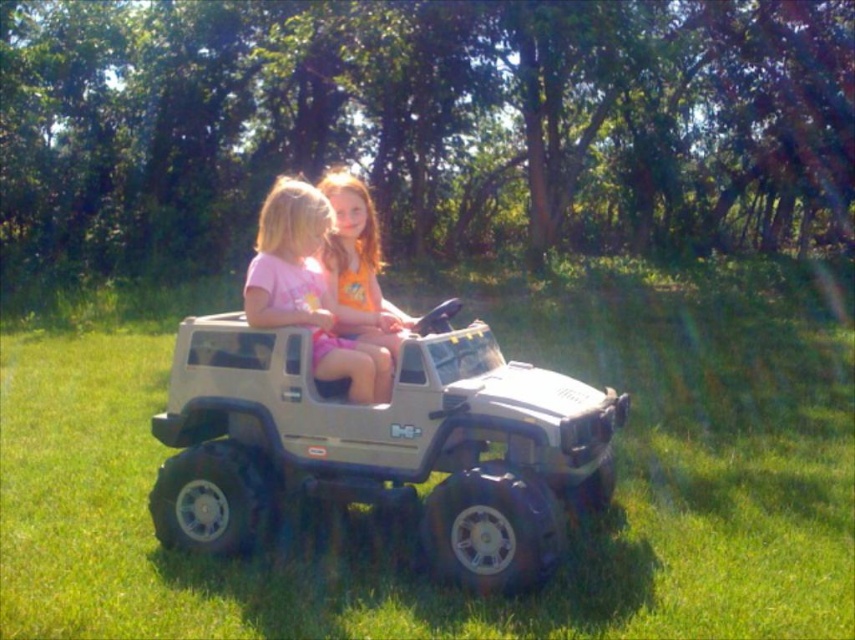
Consider the image. Does green grass at center have a greater width compared to matte pink shirt at center?

A: Correct, the width of green grass at center exceeds that of matte pink shirt at center.

Is green grass at center bigger than matte pink shirt at center?

Yes.

The image size is (855, 640). Describe the element at coordinates (401, 536) in the screenshot. I see `green grass at center` at that location.

In order to click on green grass at center in this screenshot , I will do `click(401, 536)`.

In the scene shown: Does green grass at center appear over orange cotton shirt at center?

Incorrect, green grass at center is not positioned above orange cotton shirt at center.

Who is positioned more to the left, green grass at center or orange cotton shirt at center?

orange cotton shirt at center is more to the left.

What are the coordinates of `green grass at center` in the screenshot? It's located at (401, 536).

Does green grass at center have a lesser width compared to matte silver toy jeep at center?

In fact, green grass at center might be wider than matte silver toy jeep at center.

Who is higher up, green grass at center or matte silver toy jeep at center?

green grass at center is above.

Does point (699, 442) lie in front of point (187, 371)?

No, (699, 442) is further to viewer.

Locate an element on the screen. The height and width of the screenshot is (640, 855). green grass at center is located at coordinates (401, 536).